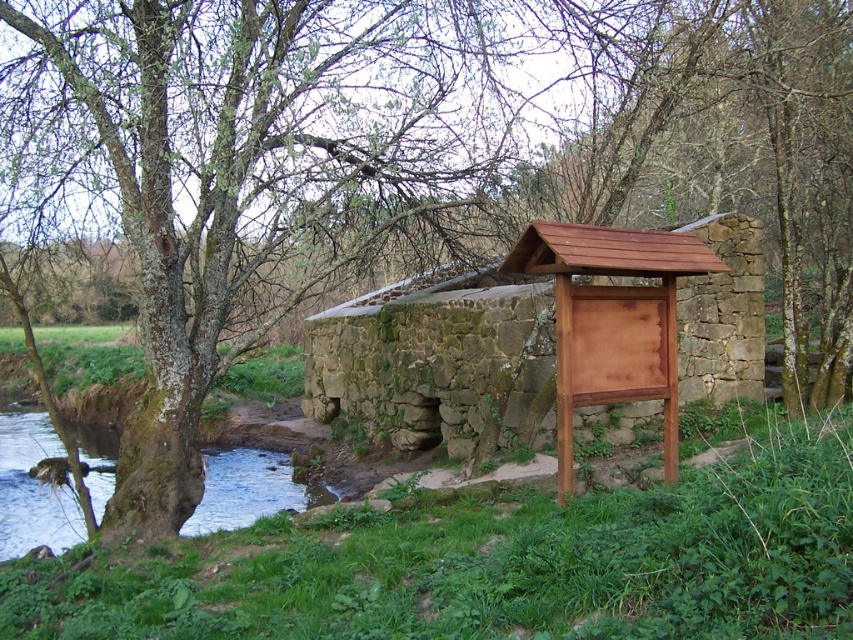
Can you confirm if brown wooden sign at center is positioned above clear water at lower left?

Correct, brown wooden sign at center is located above clear water at lower left.

Can you confirm if brown wooden sign at center is positioned below clear water at lower left?

No.

Find the location of a particular element. Image resolution: width=853 pixels, height=640 pixels. brown wooden sign at center is located at coordinates (434, 358).